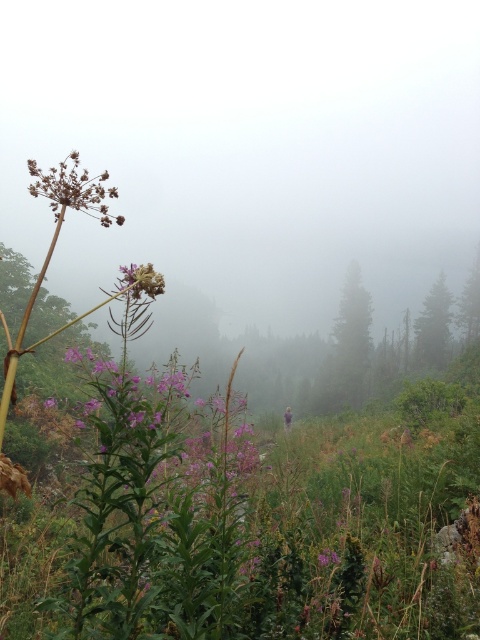
Question: Estimate the real-world distances between objects in this image. Which object is farther from the green matte tree at right?

Choices:
 (A) brown textured flower at upper left
 (B) green matte tree at center
 (C) purple matte flower at upper left

Answer: (A)

Question: Is green matte tree at center positioned at the back of purple matte flower at upper left?

Choices:
 (A) no
 (B) yes

Answer: (B)

Question: Can you confirm if brown textured flower at upper left is thinner than green matte tree at right?

Choices:
 (A) yes
 (B) no

Answer: (B)

Question: Is green matte tree at center positioned in front of green matte tree at right?

Choices:
 (A) no
 (B) yes

Answer: (B)

Question: Which object is farther from the camera taking this photo?

Choices:
 (A) brown textured flower at upper left
 (B) green matte tree at right
 (C) purple matte flower at upper left

Answer: (B)

Question: Which point appears closest to the camera in this image?

Choices:
 (A) (432, 349)
 (B) (364, 371)

Answer: (B)